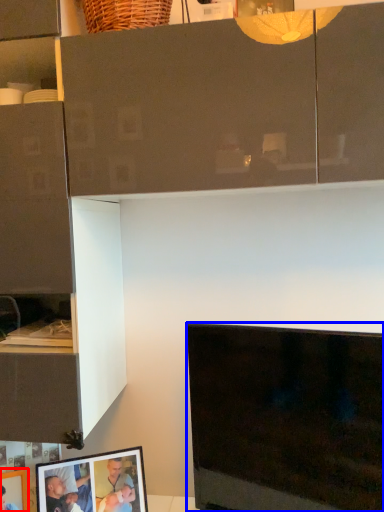
Question: Which of the following is the farthest to the observer, picture frame (highlighted by a red box) or television (highlighted by a blue box)?

Choices:
 (A) picture frame
 (B) television

Answer: (A)